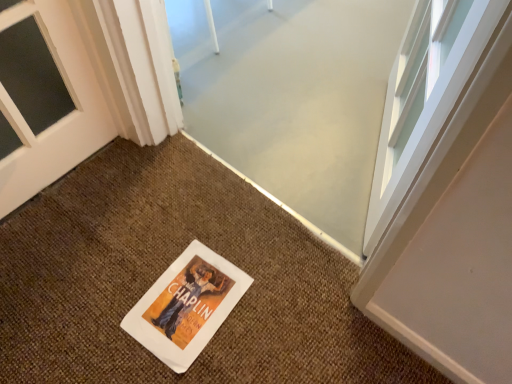
Locate an element on the screen. free space above white paper flyer at center (from a real-world perspective) is located at coordinates (193, 297).